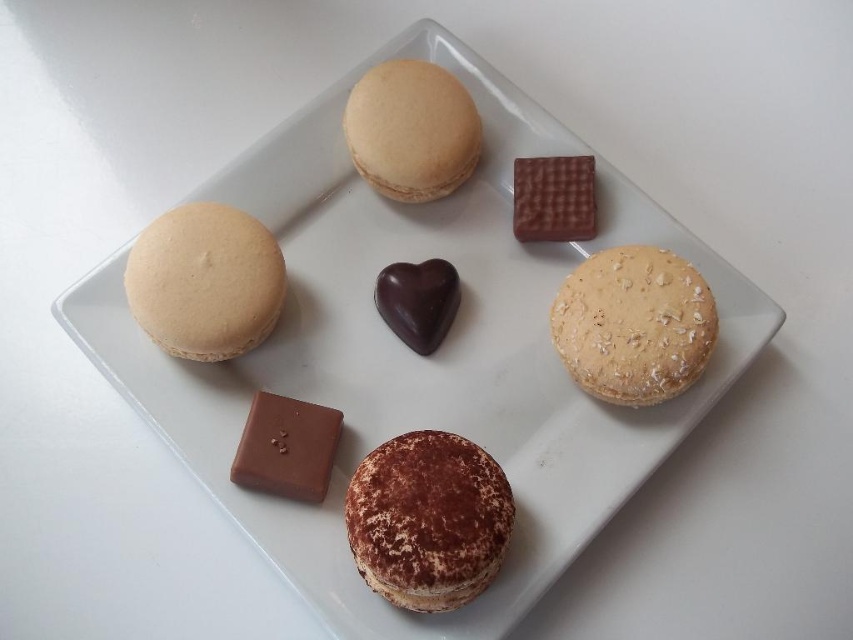
You are a customer at a bakery and want to pick up the matte beige macaron at upper left and the smooth brown chocolate bar at bottom left. Which item will you need to reach over first?

You will need to reach over the matte beige macaron at upper left first because it is closer to you than the smooth brown chocolate bar at bottom left, which is further away.